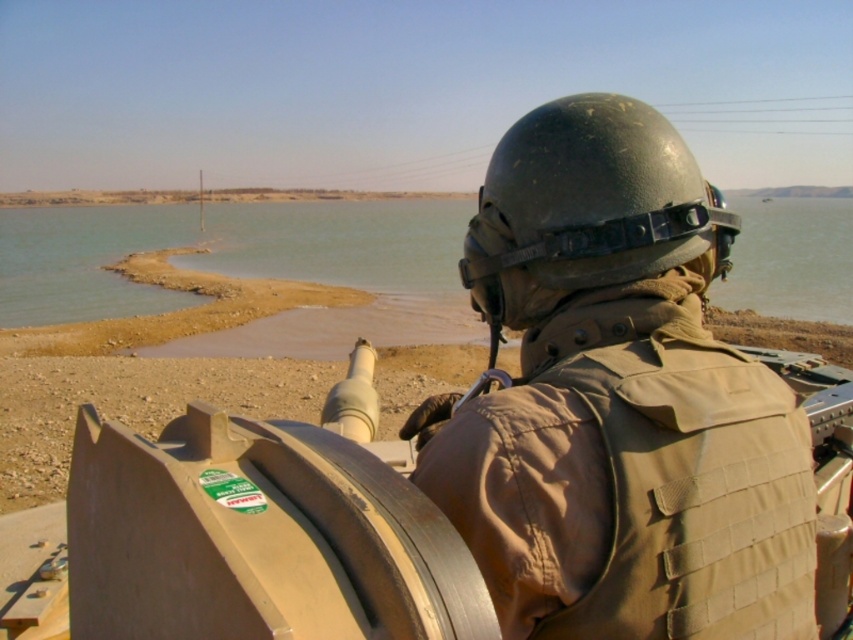
From the picture: Can you confirm if matte green helmet at center is shorter than smooth sand at water center?

Yes, matte green helmet at center is shorter than smooth sand at water center.

Does matte green helmet at center have a greater height compared to smooth sand at water center?

Incorrect, matte green helmet at center's height is not larger of smooth sand at water center's.

Who is more forward, (x=477, y=532) or (x=186, y=218)?

Positioned in front is point (x=477, y=532).

The width and height of the screenshot is (853, 640). In order to click on matte green helmet at center in this screenshot , I will do `click(618, 401)`.

Can you confirm if matte green helmet at center is wider than matte black helmet at center?

Yes, matte green helmet at center is wider than matte black helmet at center.

Is matte green helmet at center behind matte black helmet at center?

That is False.

Is point (709, 209) less distant than point (514, 136)?

Yes.

Find the location of a particular element. The height and width of the screenshot is (640, 853). matte green helmet at center is located at coordinates pos(618,401).

Can you confirm if smooth sand at water center is positioned below matte black helmet at center?

Incorrect, smooth sand at water center is not positioned below matte black helmet at center.

Is point (6, 256) positioned after point (630, 116)?

Yes, it is behind point (630, 116).

Looking at this image, who is more forward, (761, 236) or (496, 296)?

Point (496, 296) is in front.

The image size is (853, 640). I want to click on smooth sand at water center, so click(248, 268).